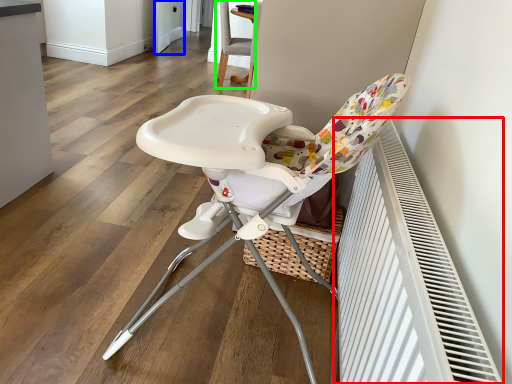
Question: Estimate the real-world distances between objects in this image. Which object is closer to air conditioning (highlighted by a red box), screen door (highlighted by a blue box) or chair (highlighted by a green box)?

Choices:
 (A) screen door
 (B) chair

Answer: (B)